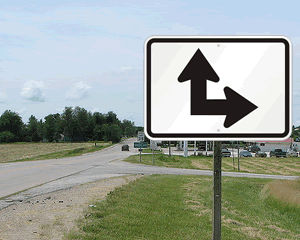
Image resolution: width=300 pixels, height=240 pixels. What are the coordinates of `corner` in the screenshot? It's located at (120, 168).